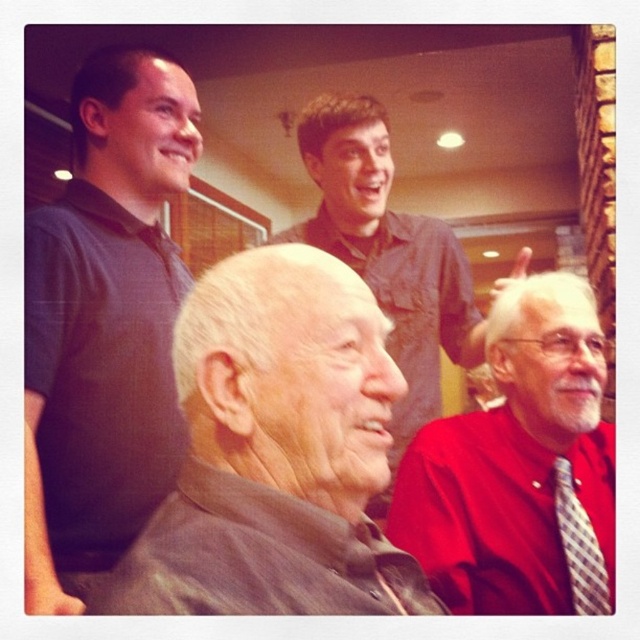
You are standing in the same room as the scene. Where is the denim shirt at upper center located in terms of coordinates?

The denim shirt at upper center is located at point [388,252].